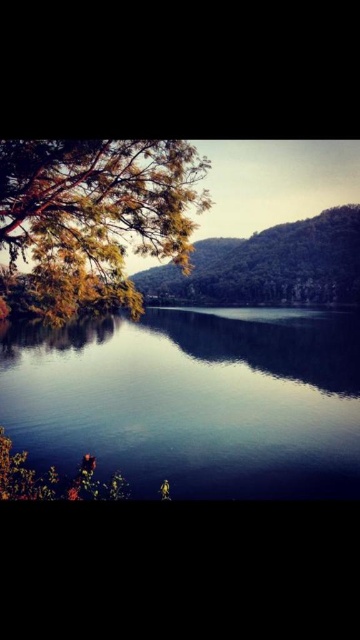
You are standing at the lakeside and want to locate the point marked as point [194,400]. Based on the scene description, where would you find this point?

The point [194,400] is on the smooth reflective water at center, so you would find it in the middle of the lake where the water is calm and reflective.

Based on the scene description, can you identify the object located at the coordinates point (x=92, y=218)?

The object at point (x=92, y=218) is the green leafy tree at upper left.

You are standing at the lakeside and see the green leafy tree at upper left and the green matte tree at center. Which tree is closer to your left side?

The green leafy tree at upper left is positioned on the left side of green matte tree at center, so it is closer to your left side.